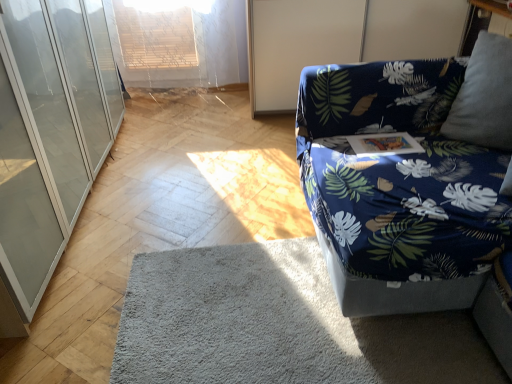
Question: Considering the relative positions of gray soft rug at lower center and transparent glass cabinet at left in the image provided, is gray soft rug at lower center to the left of transparent glass cabinet at left from the viewer's perspective?

Choices:
 (A) yes
 (B) no

Answer: (B)

Question: Is gray soft rug at lower center at the right side of transparent glass cabinet at left?

Choices:
 (A) yes
 (B) no

Answer: (A)

Question: Considering the relative sizes of gray soft rug at lower center and transparent glass cabinet at left in the image provided, is gray soft rug at lower center shorter than transparent glass cabinet at left?

Choices:
 (A) yes
 (B) no

Answer: (A)

Question: Is gray soft rug at lower center positioned with its back to transparent glass cabinet at left?

Choices:
 (A) no
 (B) yes

Answer: (A)

Question: Is gray soft rug at lower center wider than transparent glass cabinet at left?

Choices:
 (A) yes
 (B) no

Answer: (A)

Question: Does point (30, 198) appear closer or farther from the camera than point (258, 72)?

Choices:
 (A) farther
 (B) closer

Answer: (B)

Question: Is transparent glass cabinet at left wider or thinner than blue fabric screen door at upper right?

Choices:
 (A) wide
 (B) thin

Answer: (B)

Question: From the image's perspective, relative to blue fabric screen door at upper right, is transparent glass cabinet at left above or below?

Choices:
 (A) below
 (B) above

Answer: (A)

Question: Is transparent glass cabinet at left spatially inside blue fabric screen door at upper right, or outside of it?

Choices:
 (A) outside
 (B) inside

Answer: (A)

Question: In terms of width, does gray soft rug at lower center look wider or thinner when compared to blue fabric couch at right?

Choices:
 (A) thin
 (B) wide

Answer: (B)

Question: Based on their positions, is gray soft rug at lower center located to the left or right of blue fabric couch at right?

Choices:
 (A) right
 (B) left

Answer: (B)

Question: In the image, is gray soft rug at lower center positioned in front of or behind blue fabric couch at right?

Choices:
 (A) behind
 (B) front

Answer: (A)

Question: From a real-world perspective, is gray soft rug at lower center above or below blue fabric couch at right?

Choices:
 (A) above
 (B) below

Answer: (B)

Question: Considering the positions of blue fabric screen door at upper right and transparent glass cabinet at left in the image, is blue fabric screen door at upper right taller or shorter than transparent glass cabinet at left?

Choices:
 (A) short
 (B) tall

Answer: (A)

Question: Is point (281, 1) positioned closer to the camera than point (78, 190)?

Choices:
 (A) farther
 (B) closer

Answer: (A)